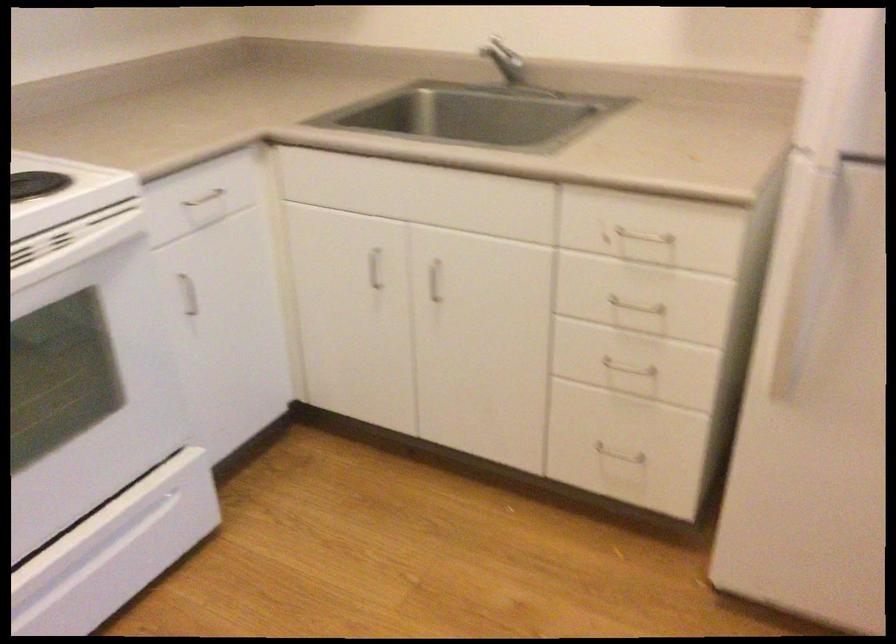
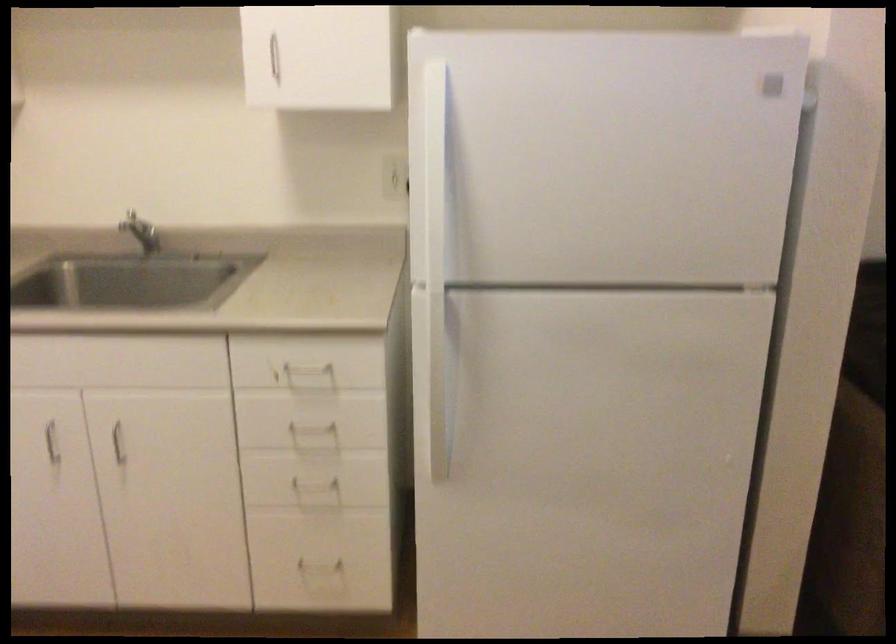
In the second image, find the point that corresponds to the point at 614,448 in the first image.

(317, 560)